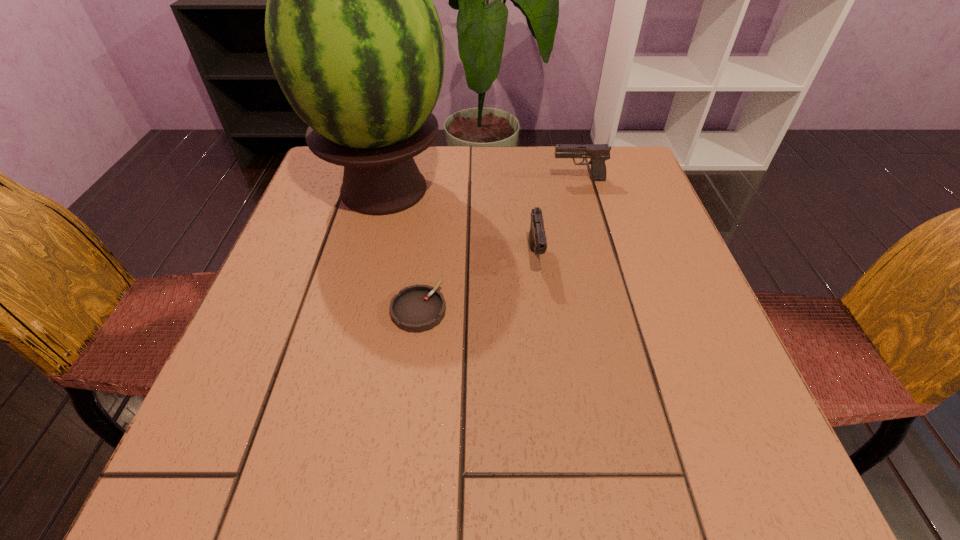
Where is `the tallest object`? Image resolution: width=960 pixels, height=540 pixels. the tallest object is located at coordinates (355, 42).

Where is `the farther pistol`? This screenshot has width=960, height=540. the farther pistol is located at coordinates (598, 153).

Identify the location of the rightmost object. click(598, 153).

Image resolution: width=960 pixels, height=540 pixels. I want to click on the third farthest object, so click(x=537, y=239).

The height and width of the screenshot is (540, 960). I want to click on the nearer pistol, so click(537, 239).

Image resolution: width=960 pixels, height=540 pixels. I want to click on ashtray, so click(418, 308).

Identify the location of the nearest object. (418, 308).

This screenshot has width=960, height=540. In order to click on free space located on the right of the watermelon in this screenshot , I will do `click(592, 190)`.

Find the location of a particular element. This screenshot has width=960, height=540. vacant point located aim along the barrel of the rightmost object is located at coordinates (419, 180).

Identify the location of vacant area situated 0.370m aim along the barrel of the rightmost object. (403, 180).